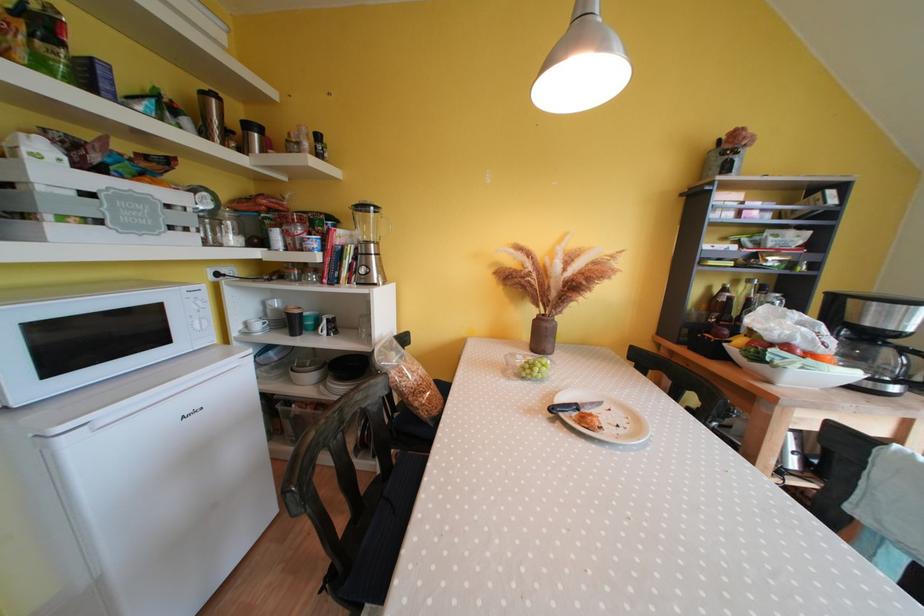
In order to click on chair sitting surface in this screenshot , I will do `click(382, 522)`.